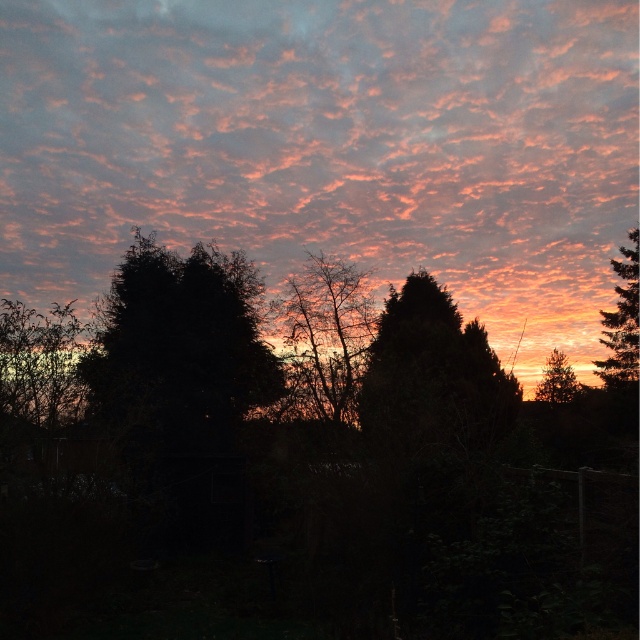
Question: Does dark green leafy tree at center have a larger size compared to green textured tree at right?

Choices:
 (A) no
 (B) yes

Answer: (B)

Question: Based on their relative distances, which object is farther from the green textured tree at right?

Choices:
 (A) silvery textured pine tree at right
 (B) bare branches at center
 (C) matte pink cloud at upper center

Answer: (B)

Question: Can you confirm if dark green leafy tree at center is positioned to the left of bare branches at center?

Choices:
 (A) yes
 (B) no

Answer: (A)

Question: Among these points, which one is farthest from the camera?

Choices:
 (A) (572, 396)
 (B) (458, 368)

Answer: (A)

Question: Which object appears closest to the camera in this image?

Choices:
 (A) dark green textured tree at center
 (B) green textured tree at right
 (C) silvery textured pine tree at right

Answer: (A)

Question: Does dark green leafy tree at center have a larger size compared to dark green textured tree at center?

Choices:
 (A) yes
 (B) no

Answer: (A)